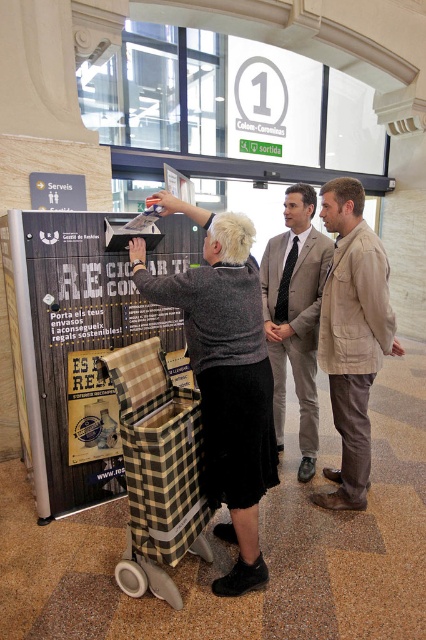
Which is more to the right, wooden plaid basket at center or beige fabric jacket at center?

Positioned to the right is beige fabric jacket at center.

Does wooden plaid basket at center appear over beige fabric jacket at center?

Incorrect, wooden plaid basket at center is not positioned above beige fabric jacket at center.

Which is in front, point (63, 426) or point (359, 227)?

Point (359, 227) is in front.

The width and height of the screenshot is (426, 640). I want to click on wooden plaid basket at center, so click(81, 349).

Is point (247, 412) closer to camera compared to point (307, 388)?

Yes, point (247, 412) is in front of point (307, 388).

Is plaid fabric shopping cart at center positioned at the back of light beige suit at center?

No.

Identify the location of plaid fabric shopping cart at center. (226, 378).

Locate an element on the screen. plaid fabric shopping cart at center is located at coordinates (226, 378).

Who is positioned more to the left, wooden plaid basket at center or light beige suit at center?

From the viewer's perspective, wooden plaid basket at center appears more on the left side.

Which is above, wooden plaid basket at center or light beige suit at center?

light beige suit at center is higher up.

Where is `wooden plaid basket at center`? wooden plaid basket at center is located at coordinates (81, 349).

Where is `wooden plaid basket at center`? Image resolution: width=426 pixels, height=640 pixels. wooden plaid basket at center is located at coordinates (81, 349).